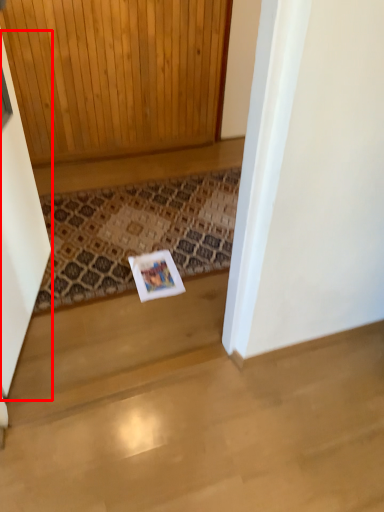
Question: Where is screen door (annotated by the red box) located in relation to doormat in the image?

Choices:
 (A) left
 (B) right

Answer: (A)